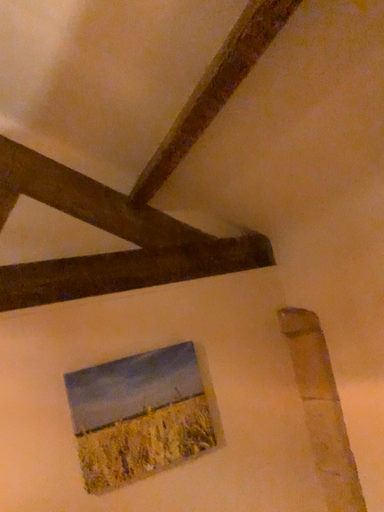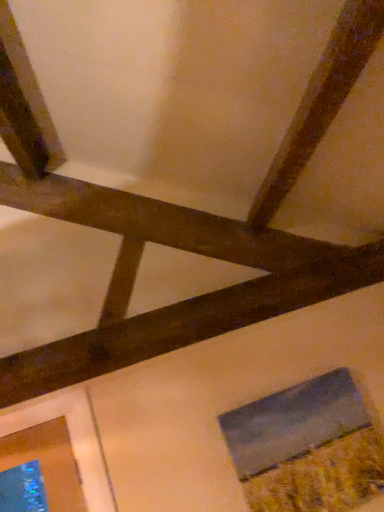
Question: How did the camera likely rotate when shooting the video?

Choices:
 (A) rotated left
 (B) rotated right

Answer: (A)